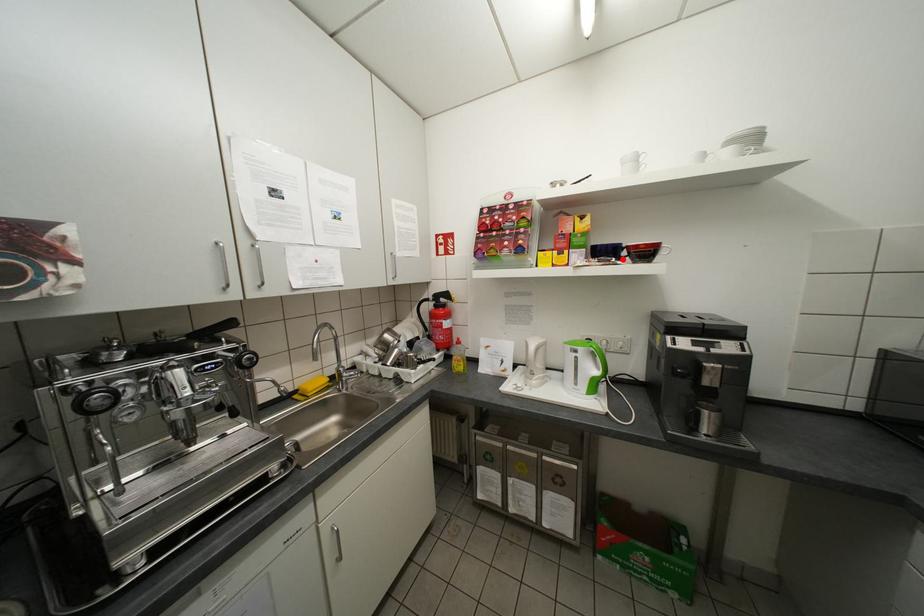
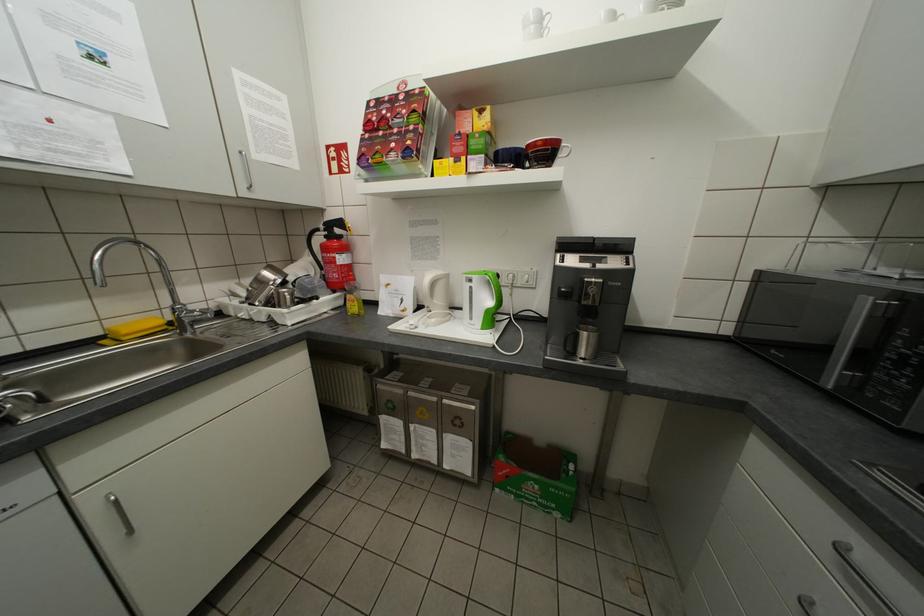
In the second image, find the point that corresponds to the highlighted location in the first image.

(521, 166)